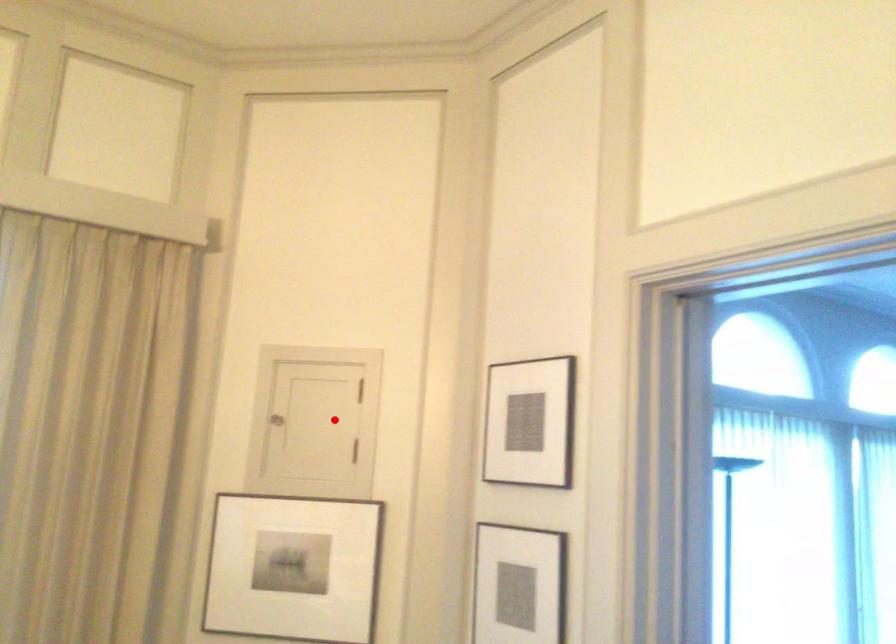
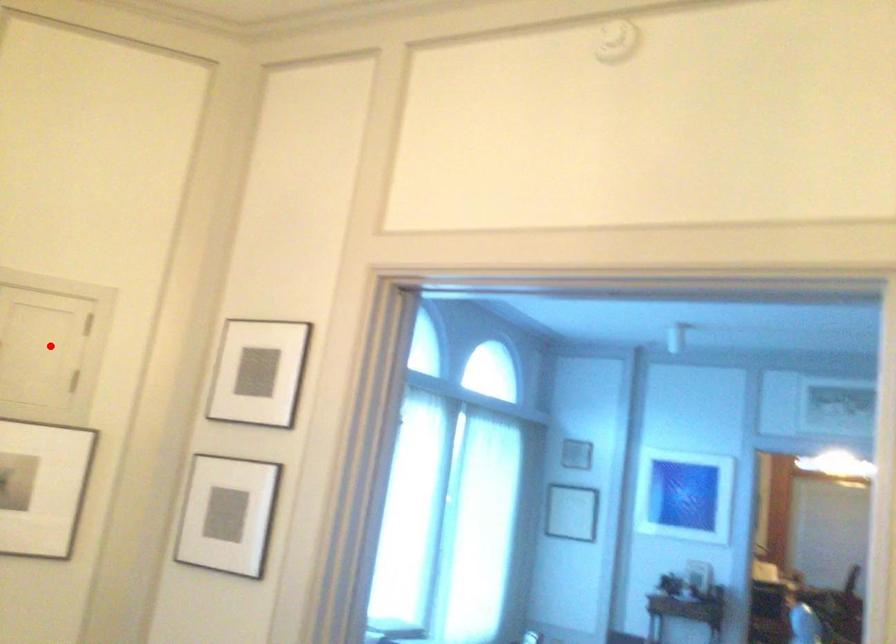
I am providing you with two images of the same scene from different viewpoints. A red point is marked on the first image and another point is marked on the second image. Is the marked point in image1 the same physical position as the marked point in image2?

Yes